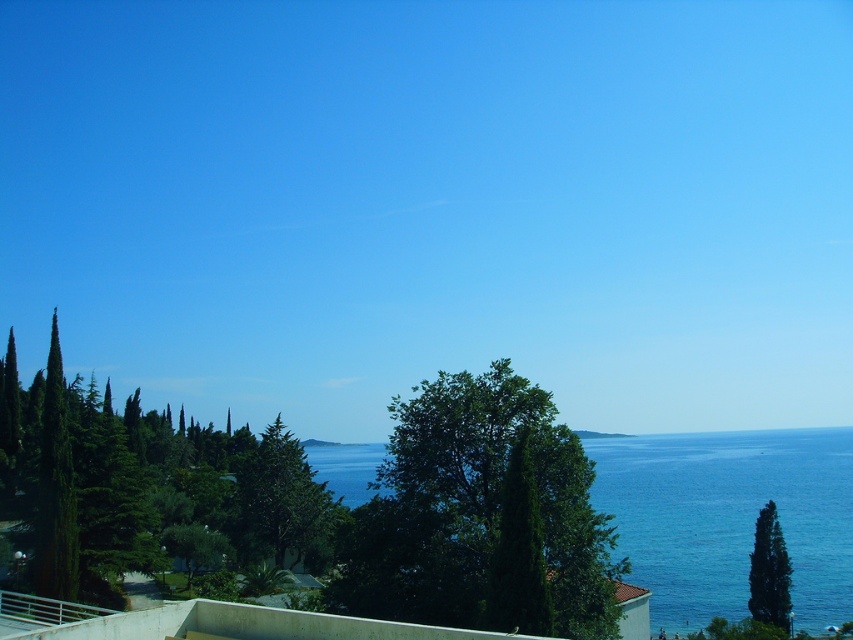
You are standing in the coastal landscape and want to place a small flag at each of the two points, point [297,493] and point [515,528]. Which point is closer to you so you can place the flag first?

Point [297,493] is closer to you because it is further to the camera than point [515,528], so you can place the flag there first.

You are a painter standing at the edge of the scene and want to capture the blue liquid water at center and the green glossy cypress tree at lower right in your painting. Which object should you allocate more horizontal space to in your canvas?

The blue liquid water at center should be allocated more horizontal space because its width surpasses that of the green glossy cypress tree at lower right.